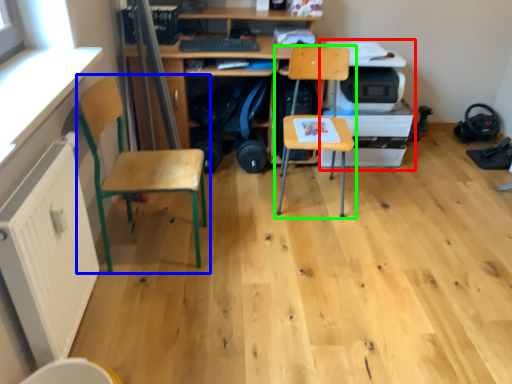
Question: Based on their relative distances, which object is nearer to printer (highlighted by a red box)? Choose from chair (highlighted by a blue box) and chair (highlighted by a green box).

Choices:
 (A) chair
 (B) chair

Answer: (B)